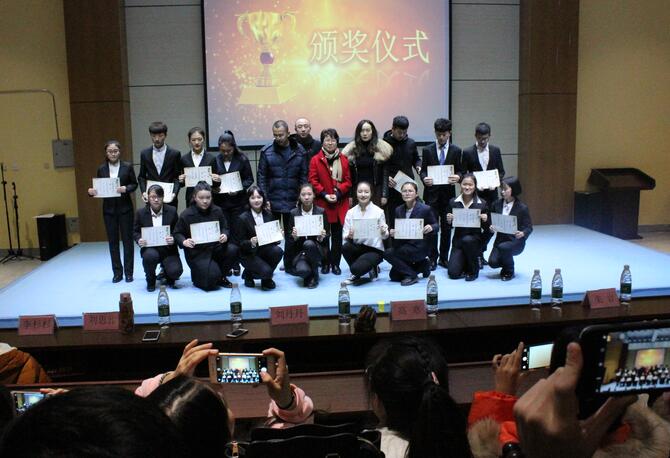
You are a GUI agent. You are given a task and a screenshot of the screen. Output one action in this format:
    pyautogui.click(x=<x>, y=<y>)
    Task: Click on the fuse box
    The height and width of the screenshot is (458, 670).
    Given the screenshot: What is the action you would take?
    pyautogui.click(x=67, y=158)